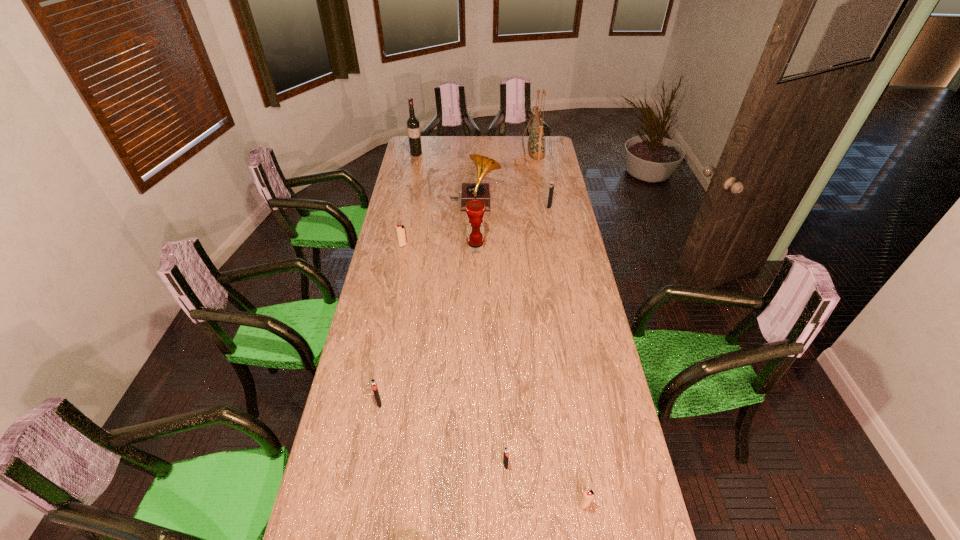
Where is `black igniter that can be found as the second closest to the eighth farthest object`? This screenshot has width=960, height=540. black igniter that can be found as the second closest to the eighth farthest object is located at coordinates (551, 189).

The image size is (960, 540). I want to click on free space that satisfies the following two spatial constraints: 1. on the front and back of the wine bottle; 2. on the left side of the leftmost black igniter, so [x=364, y=403].

At what (x,y) coordinates should I click in order to perform the action: click on vacant area in the image that satisfies the following two spatial constraints: 1. on the front side of the second nearest object; 2. on the right side of the red condiment. Please return your answer as a coordinate pair (x, y). The width and height of the screenshot is (960, 540). Looking at the image, I should click on (473, 464).

The width and height of the screenshot is (960, 540). What are the coordinates of `free spot that satisfies the following two spatial constraints: 1. from the horn of the fourth igniter from left to right; 2. on the left side of the seventh shortest object` in the screenshot? It's located at (471, 504).